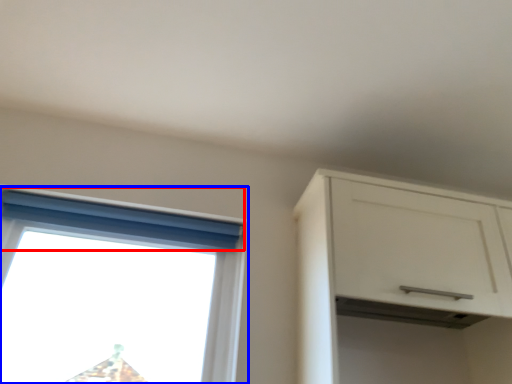
Question: Which point is closer to the camera, curtain (highlighted by a red box) or window (highlighted by a blue box)?

Choices:
 (A) curtain
 (B) window

Answer: (B)